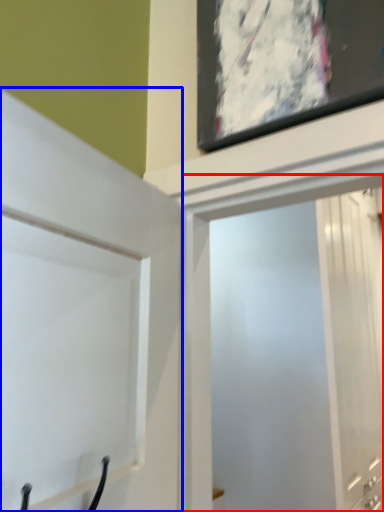
Question: Among these objects, which one is nearest to the camera, screen door (highlighted by a red box) or door (highlighted by a blue box)?

Choices:
 (A) screen door
 (B) door

Answer: (B)